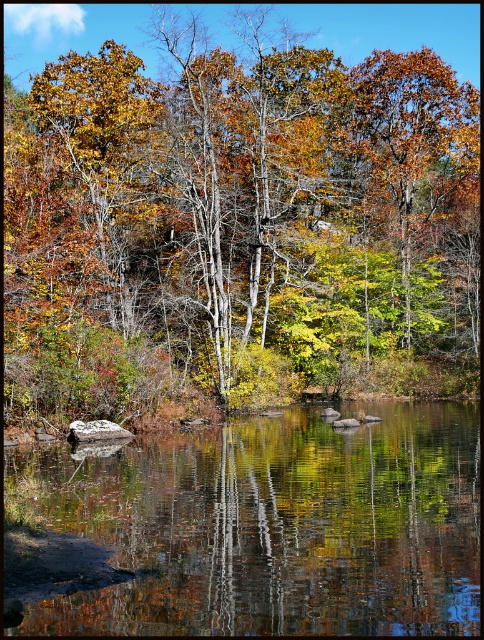
You are standing at the edge of the water and want to know which object in the scene is wider. Based on the green leafy tree at center and the reflective smooth water at center, which one has a greater width?

The green leafy tree at center has a greater width than the reflective smooth water at center.

You are standing at the edge of the water and want to take a photo of the green leafy tree at center. Based on its position, where should you aim your camera to capture it in the frame?

The green leafy tree at center is located at point coordinates approximately 0.347 along the horizontal axis and 0.492 along the vertical axis. To capture it, aim your camera towards the center area slightly to the right and lower portion of the scene.